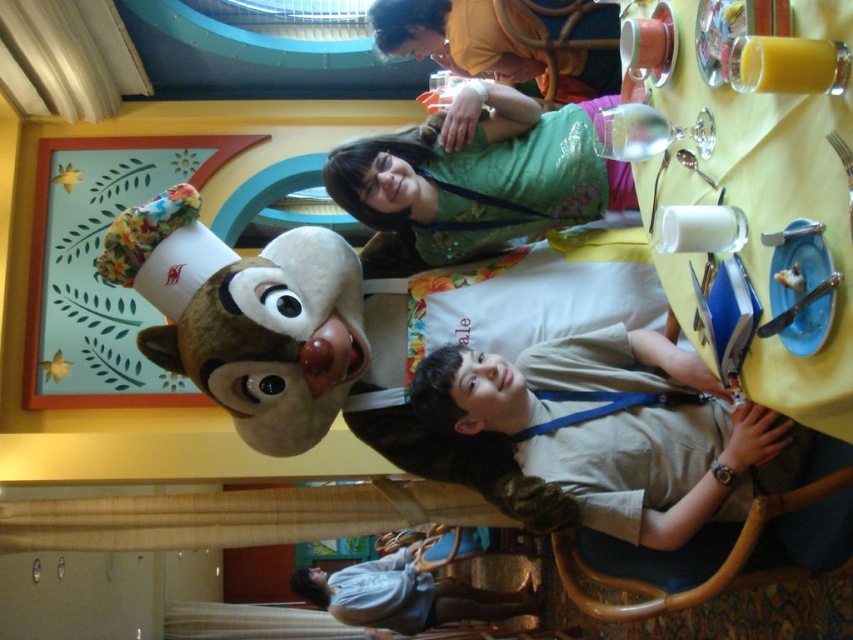
Is the position of fluffy brown plush toy at upper left more distant than that of denim shirt at lower center?

No.

Can you confirm if fluffy brown plush toy at upper left is positioned to the right of denim shirt at lower center?

Yes, fluffy brown plush toy at upper left is to the right of denim shirt at lower center.

Is point (164, 301) behind point (505, 602)?

That is False.

Locate an element on the screen. fluffy brown plush toy at upper left is located at coordinates (245, 316).

Who is positioned more to the right, green fabric shirt at upper center or denim shirt at lower center?

green fabric shirt at upper center is more to the right.

Which is more to the left, green fabric shirt at upper center or denim shirt at lower center?

Positioned to the left is denim shirt at lower center.

This screenshot has height=640, width=853. In order to click on green fabric shirt at upper center in this screenshot , I will do coord(480,173).

The image size is (853, 640). Identify the location of green fabric shirt at upper center. (480, 173).

Is light brown uniform at center positioned at the back of fluffy brown plush toy at upper left?

No, light brown uniform at center is in front of fluffy brown plush toy at upper left.

Is the position of light brown uniform at center less distant than that of fluffy brown plush toy at upper left?

Yes.

Which is behind, point (733, 412) or point (241, 433)?

The point (241, 433) is behind.

Identify the location of light brown uniform at center. (619, 428).